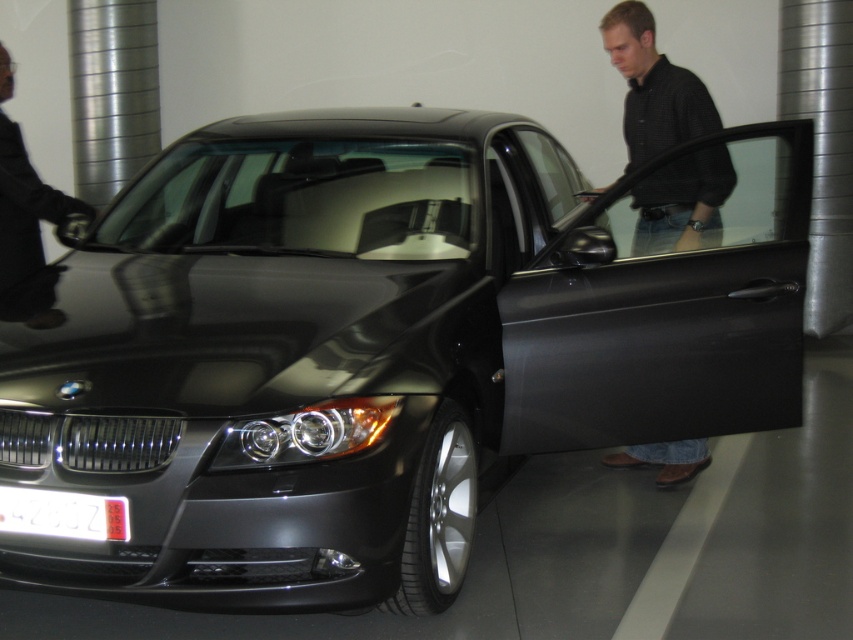
Question: Which point is farther from the camera taking this photo?

Choices:
 (A) (91, 534)
 (B) (15, 234)

Answer: (B)

Question: Does dark gray shirt at center have a smaller size compared to white plastic license plate at lower left?

Choices:
 (A) yes
 (B) no

Answer: (B)

Question: Which point appears farthest from the camera in this image?

Choices:
 (A) (51, 220)
 (B) (628, 13)

Answer: (B)

Question: Which object is positioned closest to the white plastic license plate at lower left?

Choices:
 (A) matte black jacket at left
 (B) dark gray shirt at center

Answer: (A)

Question: Can you confirm if matte black jacket at left is smaller than dark gray shirt at center?

Choices:
 (A) no
 (B) yes

Answer: (A)

Question: Where is dark gray shirt at center located in relation to white plastic license plate at lower left in the image?

Choices:
 (A) below
 (B) above

Answer: (B)